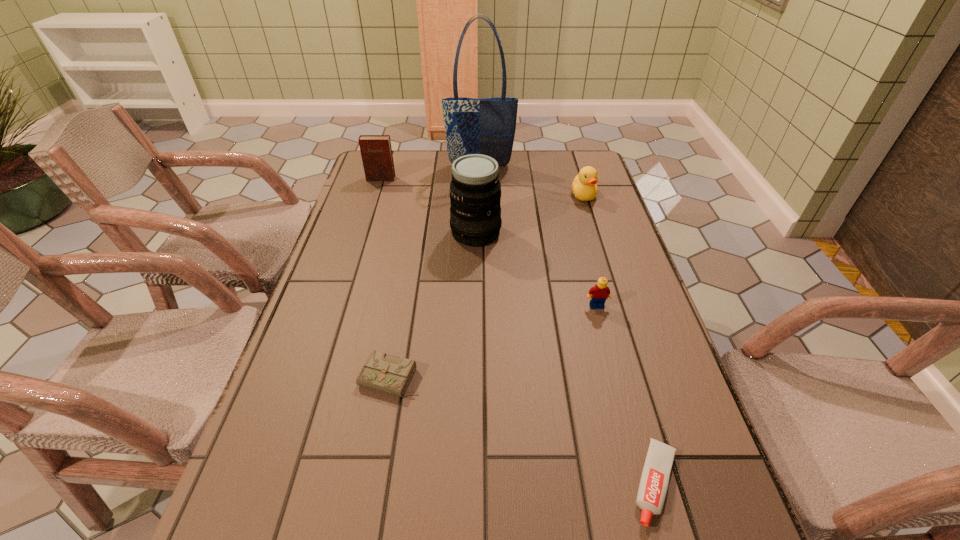
The image size is (960, 540). What are the coordinates of `shopping bag` in the screenshot? It's located at (486, 126).

Find the location of a particular element. the tallest object is located at coordinates (486, 126).

Locate an element on the screen. This screenshot has width=960, height=540. the fourth nearest object is located at coordinates (475, 190).

At what (x,y) coordinates should I click in order to perform the action: click on telephoto lens. Please return your answer as a coordinate pair (x, y). The image size is (960, 540). Looking at the image, I should click on [x=475, y=190].

Where is `the left diary`? The image size is (960, 540). the left diary is located at coordinates (376, 152).

At what (x,y) coordinates should I click in order to perform the action: click on the fifth shortest object. Please return your answer as a coordinate pair (x, y). This screenshot has height=540, width=960. Looking at the image, I should click on (376, 152).

Image resolution: width=960 pixels, height=540 pixels. I want to click on duckling, so click(584, 187).

This screenshot has height=540, width=960. What are the coordinates of `Lego` in the screenshot? It's located at (600, 292).

Image resolution: width=960 pixels, height=540 pixels. What are the coordinates of `the third nearest object` in the screenshot? It's located at (600, 292).

Identify the location of the second object from left to right. (380, 372).